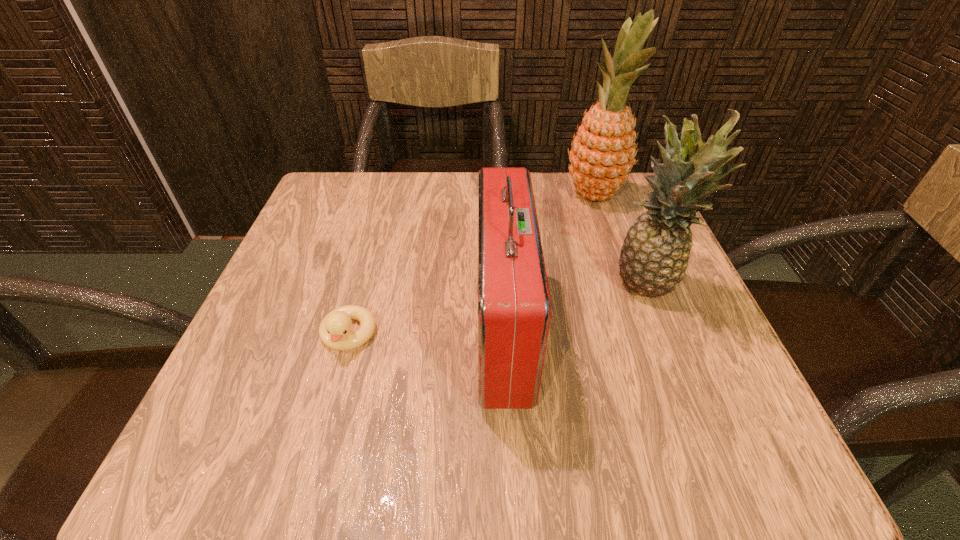
The width and height of the screenshot is (960, 540). Identify the location of the farthest object. (603, 153).

This screenshot has height=540, width=960. I want to click on the farther pineapple, so click(x=603, y=153).

Locate an element on the screen. The height and width of the screenshot is (540, 960). the nearer pineapple is located at coordinates (654, 256).

Locate an element on the screen. The image size is (960, 540). the shorter pineapple is located at coordinates (654, 256).

Where is `the third tallest object`? This screenshot has width=960, height=540. the third tallest object is located at coordinates (514, 307).

I want to click on the third object from right to left, so click(x=514, y=307).

Find the location of `duckling`. duckling is located at coordinates (334, 331).

Locate an element on the screen. the leftmost object is located at coordinates (334, 331).

I want to click on vacant space located on the front of the farther pineapple, so click(626, 287).

This screenshot has height=540, width=960. Find the location of `vacant space situated on the left of the nearer pineapple`. vacant space situated on the left of the nearer pineapple is located at coordinates (414, 287).